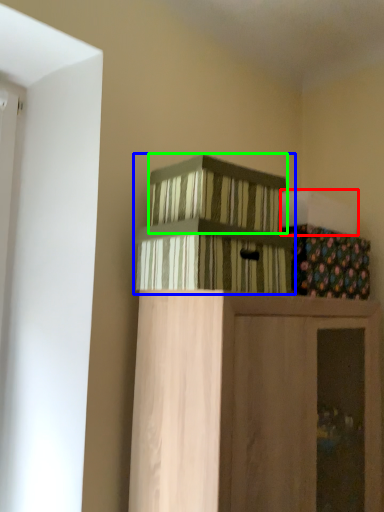
Question: Estimate the real-world distances between objects in this image. Which object is closer to box (highlighted by a red box), crate (highlighted by a blue box) or crate (highlighted by a green box)?

Choices:
 (A) crate
 (B) crate

Answer: (B)